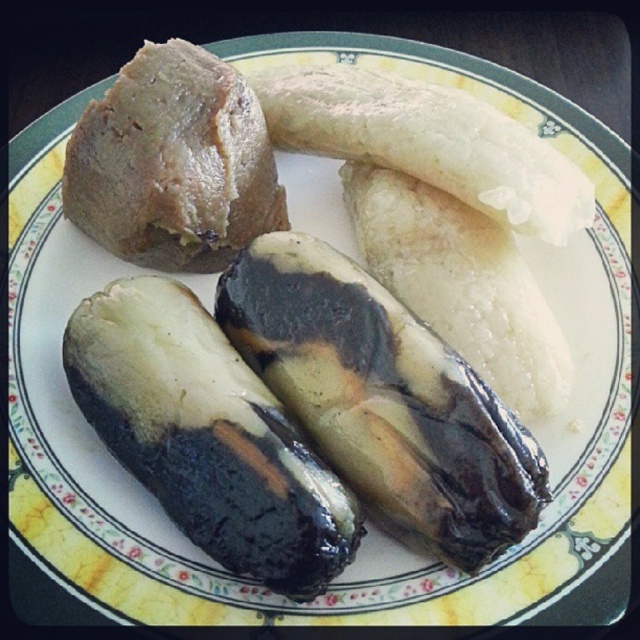
You are planning to place both the black glossy eggplant at center and the matte brown rice cake at upper left into a rectangular container. The container can only fit items that are narrower than 10 centimeters. Based on their sizes, can both items fit into the container?

The black glossy eggplant at center is wider than the matte brown rice cake at upper left. Since the container requires items to be narrower than 10 centimeters, we need to know the exact width of the eggplant. However, the description only states that the eggplant is larger in width than the rice cake, but does not provide specific measurements. Therefore, it is uncertain whether both items can fit into the container without additional information about their exact dimensions.

You are looking at the plate of food. There are two points marked on the plate. The first point is at coordinates point (252,403) and the second is at point (147,61). From your perspective, which point is closer to you?

Point (252,403) is in front of point (147,61), so the first point is closer to you.